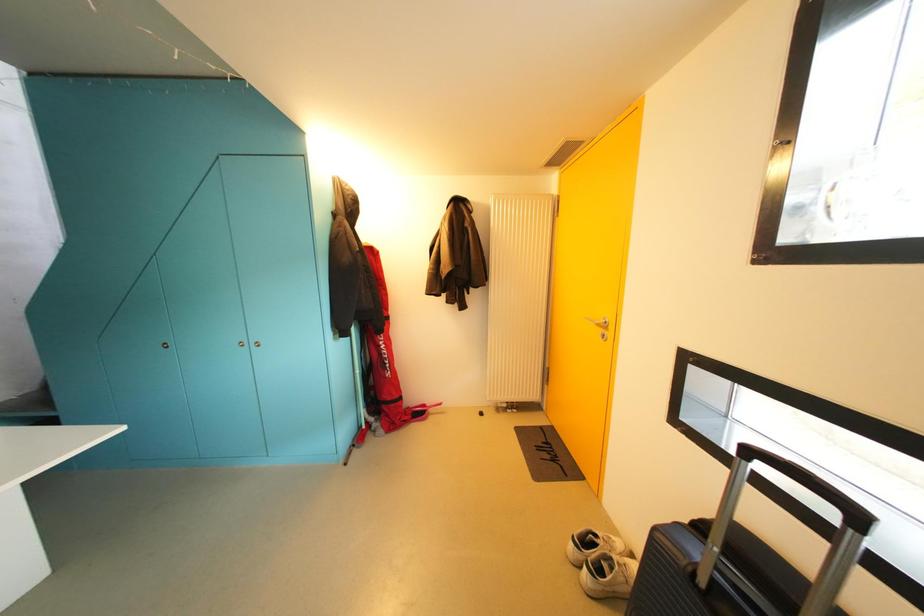
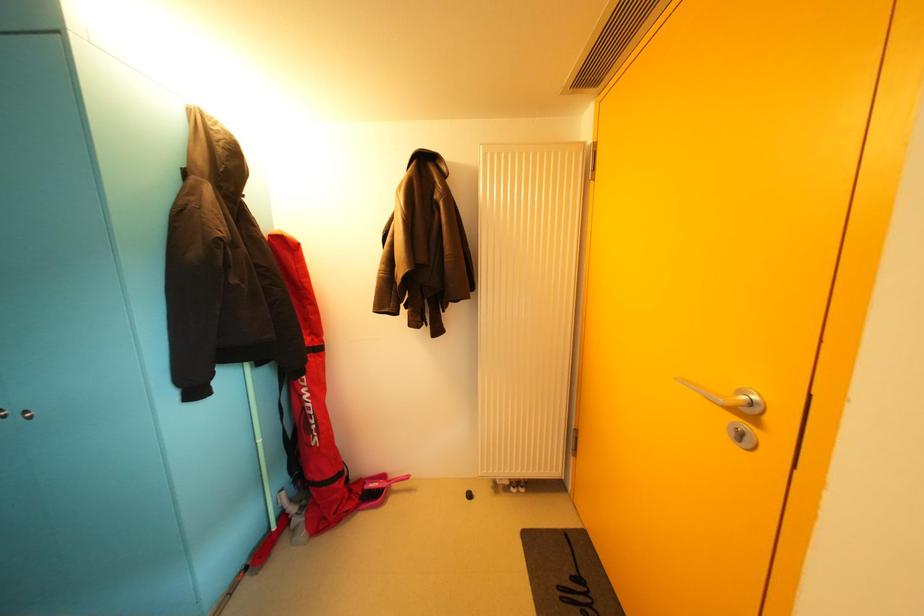
Question: The first image is from the beginning of the video and the second image is from the end. How did the camera likely rotate when shooting the video?

Choices:
 (A) Left
 (B) Right
 (C) Up
 (D) Down

Answer: (A)